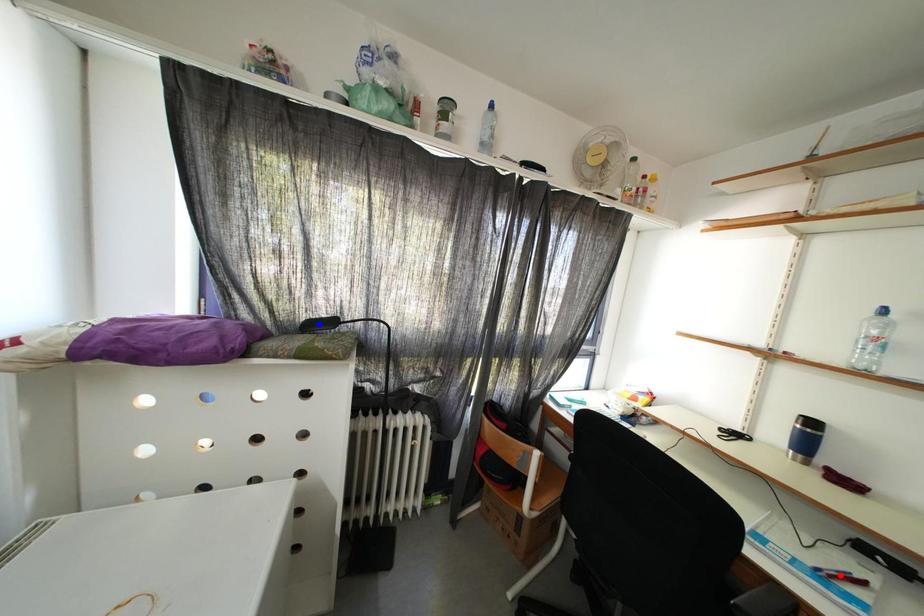
Question: Which of the two points in the image is closer to the camera?

Choices:
 (A) Blue point is closer.
 (B) Red point is closer.

Answer: (B)